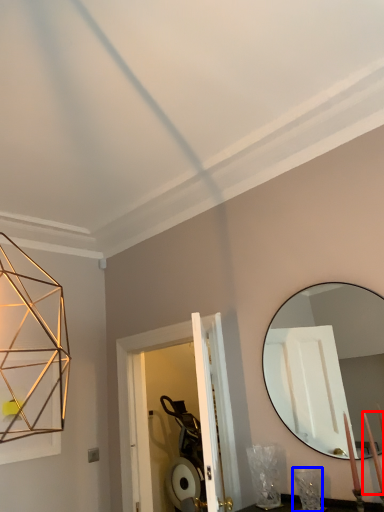
Question: Which object is closer to the camera taking this photo, candle (highlighted by a red box) or table lamp (highlighted by a blue box)?

Choices:
 (A) candle
 (B) table lamp

Answer: (A)